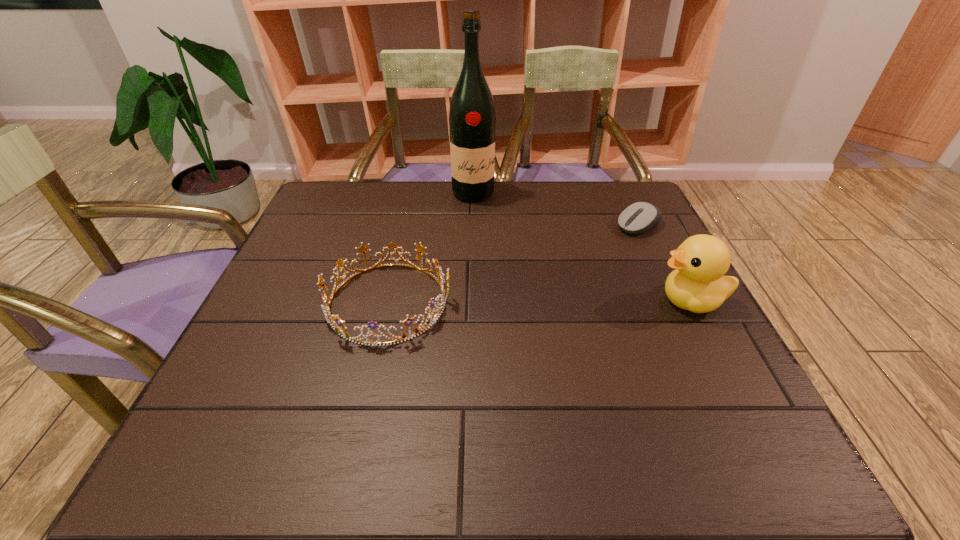
Locate an element on the screen. The image size is (960, 540). free space between the second tallest object and the shortest object is located at coordinates (664, 263).

Where is `free space between the third tallest object and the shortest object`? This screenshot has height=540, width=960. free space between the third tallest object and the shortest object is located at coordinates (513, 264).

You are a GUI agent. You are given a task and a screenshot of the screen. Output one action in this format:
    pyautogui.click(x=<x>, y=<y>)
    Task: Click on the empty space between the computer equipment and the duck
    
    Given the screenshot: What is the action you would take?
    pyautogui.click(x=664, y=263)

I want to click on vacant region between the farthest object and the third shortest object, so click(x=582, y=247).

Locate an element on the screen. This screenshot has height=540, width=960. vacant region between the third shortest object and the shortest object is located at coordinates (664, 263).

At what (x,y) coordinates should I click in order to perform the action: click on free space that is in between the second tallest object and the second farthest object. Please return your answer as a coordinate pair (x, y). This screenshot has width=960, height=540. Looking at the image, I should click on (664, 263).

Find the location of a particular element. Image resolution: width=960 pixels, height=540 pixels. vacant region between the tiara and the farthest object is located at coordinates (431, 247).

Image resolution: width=960 pixels, height=540 pixels. I want to click on object that stands as the third closest to the tallest object, so click(697, 284).

Identify which object is the second nearest to the farthest object. Please provide its 2D coordinates. Your answer should be formatted as a tuple, i.e. [(x, y)], where the tuple contains the x and y coordinates of a point satisfying the conditions above.

[(639, 217)]

You are a GUI agent. You are given a task and a screenshot of the screen. Output one action in this format:
    pyautogui.click(x=<x>, y=<y>)
    Task: Click on the vacant space that satisfies the following two spatial constraints: 1. on the front side of the computer equipment; 2. on the face of the second tallest object
    The image size is (960, 540).
    Given the screenshot: What is the action you would take?
    pyautogui.click(x=674, y=301)